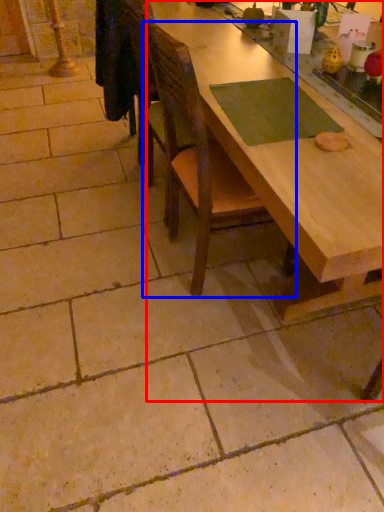
Question: Which object appears farthest to the camera in this image, table (highlighted by a red box) or chair (highlighted by a blue box)?

Choices:
 (A) table
 (B) chair

Answer: (B)